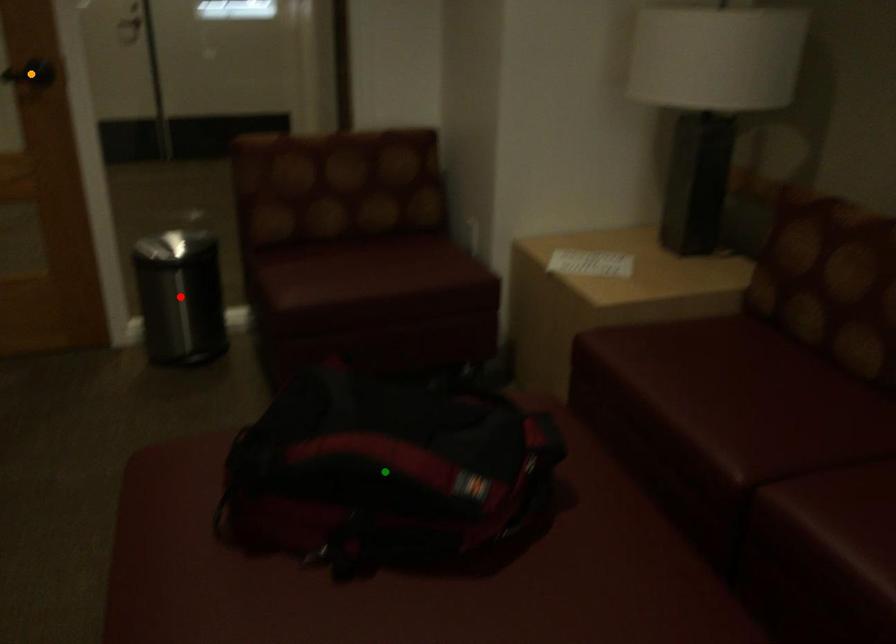
Order these from farthest to nearest:
1. red point
2. green point
3. orange point

red point
orange point
green point